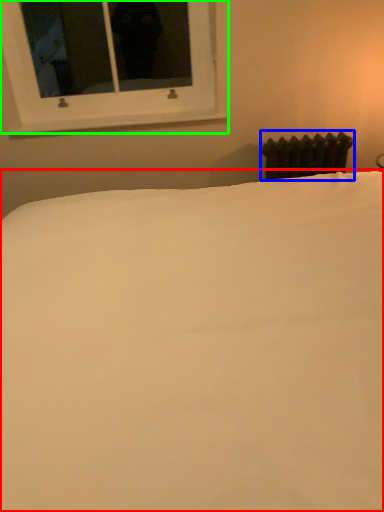
Question: Considering the real-world distances, which object is closest to bed (highlighted by a red box)? radiator (highlighted by a blue box) or window (highlighted by a green box).

Choices:
 (A) radiator
 (B) window

Answer: (A)